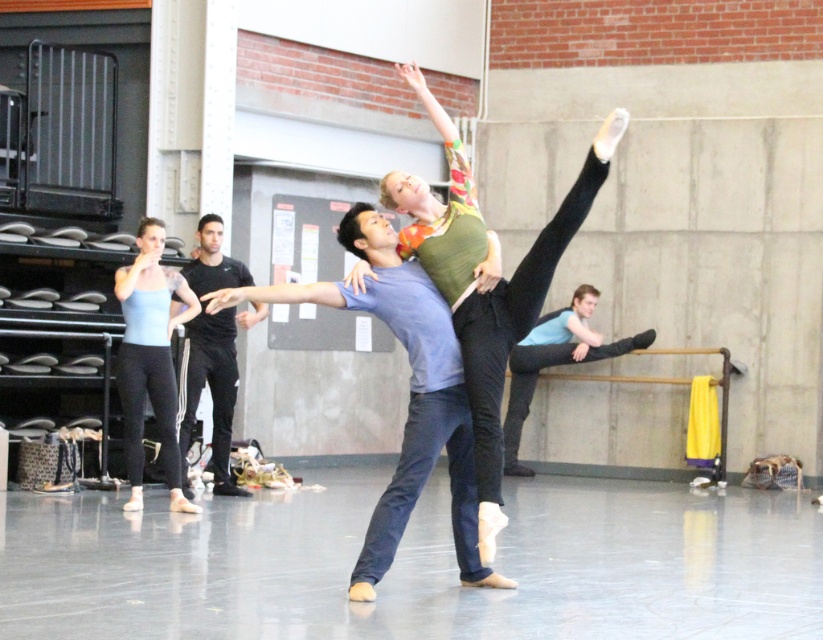
Question: Which of these objects is positioned closest to the matte blue shirt at center?

Choices:
 (A) green jersey at center
 (B) light blue fabric tank top at left

Answer: (A)

Question: Is green jersey at center smaller than black athletic wear at center?

Choices:
 (A) yes
 (B) no

Answer: (B)

Question: Does matte blue shirt at center have a smaller size compared to light blue fabric tank top at left?

Choices:
 (A) no
 (B) yes

Answer: (A)

Question: Which point is closer to the camera?

Choices:
 (A) black athletic wear at center
 (B) green jersey at center
 (C) light blue fabric tank top at left

Answer: (B)

Question: Is green jersey at center bigger than matte blue shirt at center?

Choices:
 (A) yes
 (B) no

Answer: (B)

Question: Which point is farther to the camera?

Choices:
 (A) (x=453, y=324)
 (B) (x=143, y=230)
 (C) (x=186, y=360)
 (D) (x=465, y=470)

Answer: (C)